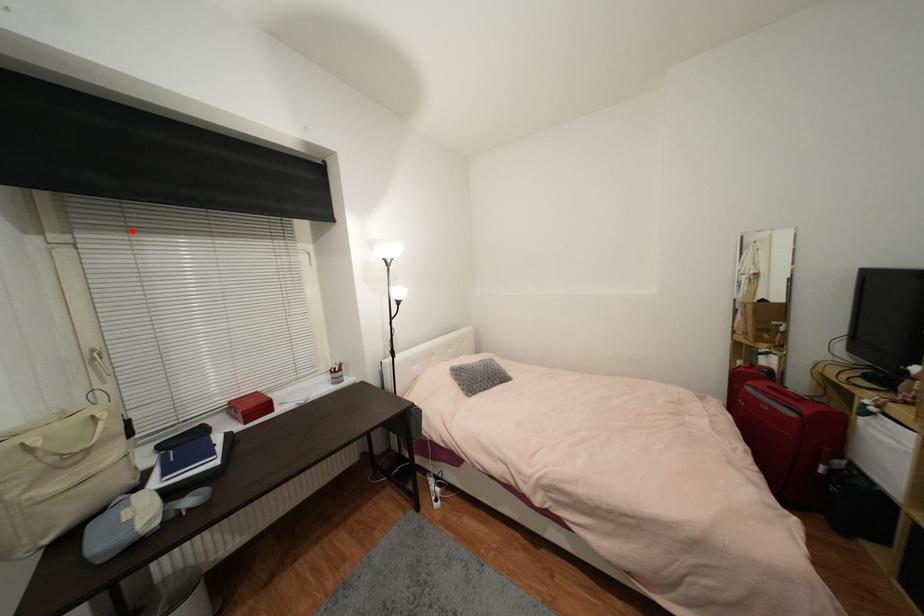
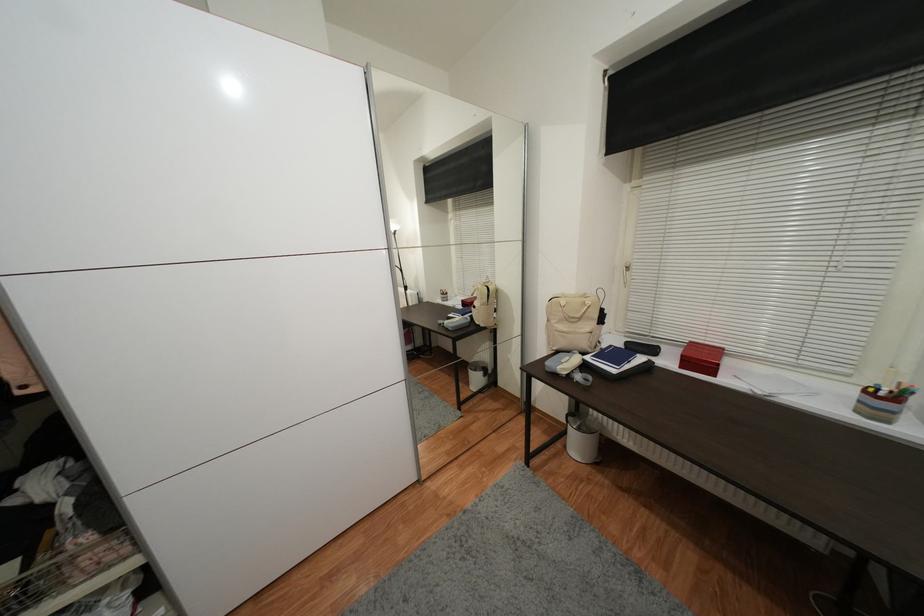
Locate, in the second image, the point that corresponds to the highlighted location in the first image.

(678, 167)